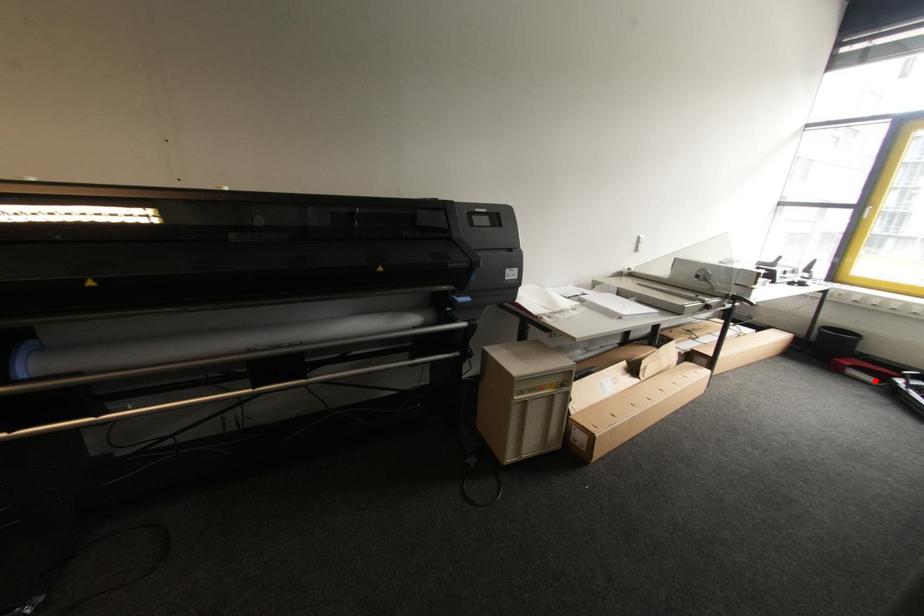
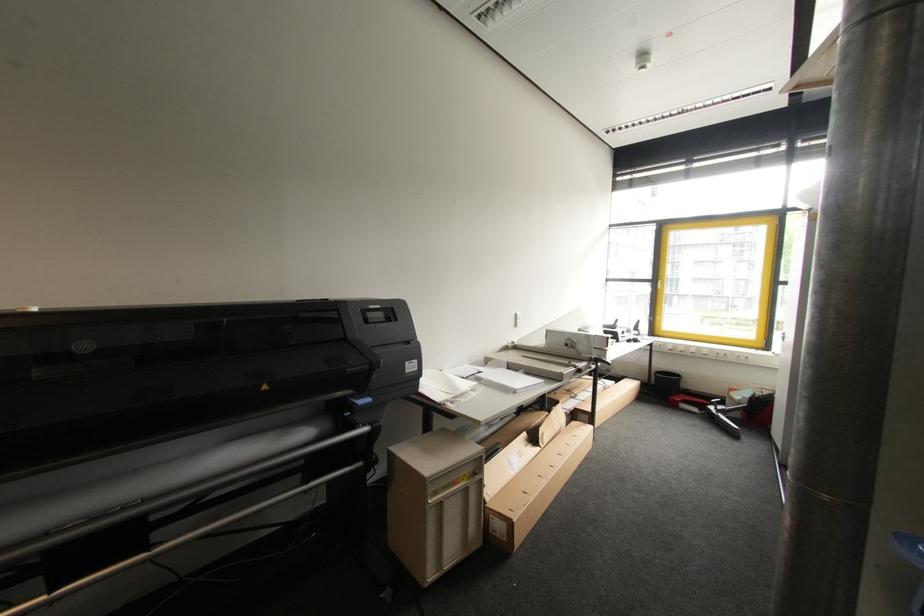
Locate, in the second image, the point that corresponds to the highlighted location in the first image.

(699, 411)